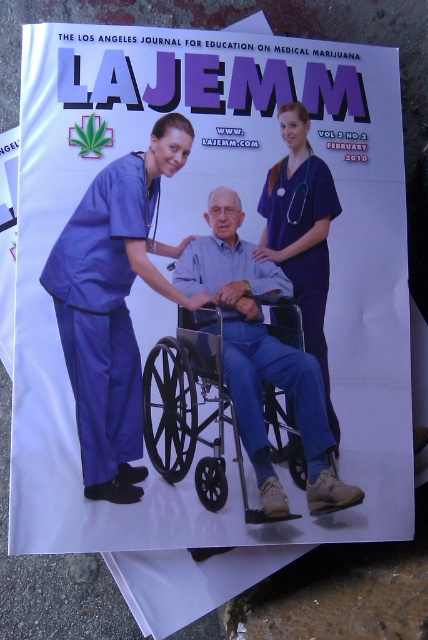
Does point (127, 173) lie behind point (190, 429)?

Yes, it is.

Does point (88, 243) lie behind point (284, 428)?

Yes.

You are a GUI agent. You are given a task and a screenshot of the screen. Output one action in this format:
    pyautogui.click(x=<x>, y=<y>)
    Task: Click on the matte blue scrubs at left
    The width and height of the screenshot is (428, 640).
    Given the screenshot: What is the action you would take?
    pyautogui.click(x=113, y=305)

Can you confirm if metallic silver wheelchair at center is positioned to the right of matte blue scrubs at center?

Incorrect, metallic silver wheelchair at center is not on the right side of matte blue scrubs at center.

Can you confirm if metallic silver wheelchair at center is thinner than matte blue scrubs at center?

No.

Between point (220, 493) and point (288, 188), which one is positioned behind?

The point (288, 188) is behind.

Identify the location of metallic silver wheelchair at center. (192, 408).

Is matte blue scrubs at left shorter than matte blue scrubs at center?

Incorrect, matte blue scrubs at left's height does not fall short of matte blue scrubs at center's.

In order to click on matte blue scrubs at left in this screenshot , I will do `click(113, 305)`.